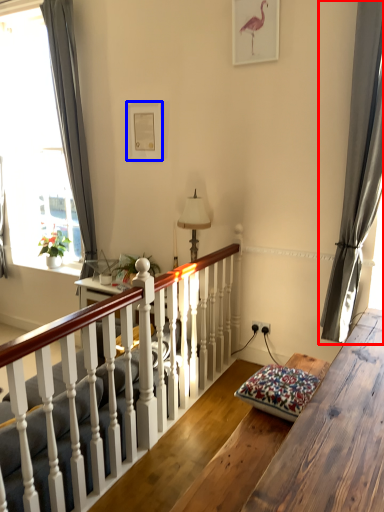
Question: Which of the following is the farthest to the observer, curtain (highlighted by a red box) or picture frame (highlighted by a blue box)?

Choices:
 (A) curtain
 (B) picture frame

Answer: (B)